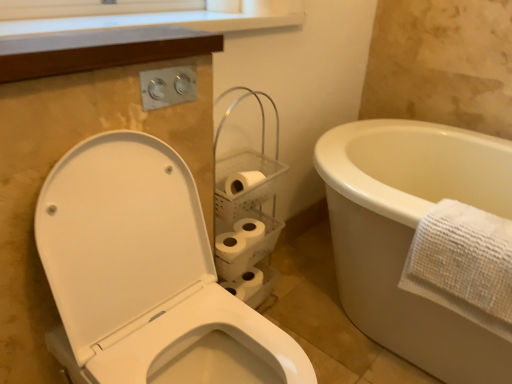
This screenshot has width=512, height=384. Identify the location of white glossy toilet at left. (145, 275).

What do you see at coordinates (463, 264) in the screenshot? The width and height of the screenshot is (512, 384). I see `white textured towel at right` at bounding box center [463, 264].

I want to click on white matte toilet paper at center, so click(239, 238).

How much distance is there between white glossy toilet at left and white textured towel at right?

They are 57.33 centimeters apart.

Does point (143, 201) lie behind point (426, 280)?

No, it is in front of (426, 280).

Between white glossy toilet at left and white textured towel at right, which one has less height?

With less height is white textured towel at right.

Are white glossy toilet at left and white textured towel at right making contact?

No.

Who is shorter, white glossy toilet at left or white matte toilet paper at center?

white matte toilet paper at center.

Looking at this image, is the depth of white glossy toilet at left greater than that of white matte toilet paper at center?

No.

From the picture: Can you confirm if white glossy toilet at left is positioned to the right of white matte toilet paper at center?

In fact, white glossy toilet at left is to the left of white matte toilet paper at center.

From the picture: Can you confirm if white matte toilet paper at center is thinner than white textured towel at right?

Yes, white matte toilet paper at center is thinner than white textured towel at right.

Is white matte toilet paper at center inside or outside of white textured towel at right?

white matte toilet paper at center is located beyond the bounds of white textured towel at right.

Considering the positions of point (238, 223) and point (489, 238), is point (238, 223) closer or farther from the camera than point (489, 238)?

Point (238, 223).

Looking at the image, does white matte toilet paper at center seem bigger or smaller compared to white textured towel at right?

Clearly, white matte toilet paper at center is smaller in size than white textured towel at right.

From a real-world perspective, is white textured towel at right on top of white matte toilet paper at center?

Correct, in the physical world, white textured towel at right is higher than white matte toilet paper at center.

Is white textured towel at right facing away from white matte toilet paper at center?

No, white matte toilet paper at center is not at the back of white textured towel at right.

Which of these two, white textured towel at right or white matte toilet paper at center, is smaller?

With smaller size is white matte toilet paper at center.

Which is in front, point (438, 286) or point (223, 249)?

Positioned in front is point (438, 286).

Is white matte toilet paper at center turned away from white glossy toilet at left?

white matte toilet paper at center does not have its back to white glossy toilet at left.

Who is more distant, white matte toilet paper at center or white glossy toilet at left?

white matte toilet paper at center.

From the image's perspective, which object appears higher, white matte toilet paper at center or white glossy toilet at left?

white matte toilet paper at center appears higher in the image.

Is white textured towel at right in front of white glossy toilet at left?

That is False.

From the image's perspective, is white textured towel at right beneath white glossy toilet at left?

Incorrect, from the image's perspective, white textured towel at right is higher than white glossy toilet at left.

Looking at this image, is white glossy toilet at left surrounded by white textured towel at right?

That's incorrect, white glossy toilet at left is not inside white textured towel at right.

What are the coordinates of `toilet that is in front of the white textured towel at right` in the screenshot? It's located at (145, 275).

Identify the location of toilet paper lying above the white glossy toilet at left (from the image's perspective). (239, 238).

Considering their positions, is white glossy toilet at left positioned closer to white textured towel at right than white matte toilet paper at center?

The object closer to white textured towel at right is white glossy toilet at left.

Considering their positions, is white glossy toilet at left positioned closer to white matte toilet paper at center than white textured towel at right?

white glossy toilet at left is positioned closer to the anchor white matte toilet paper at center.

Considering their positions, is white matte toilet paper at center positioned further to white textured towel at right than white glossy toilet at left?

Based on the image, white matte toilet paper at center appears to be further to white textured towel at right.

When comparing their distances from white matte toilet paper at center, does white textured towel at right or white glossy toilet at left seem closer?

Among the two, white glossy toilet at left is located nearer to white matte toilet paper at center.

Based on their spatial positions, is white textured towel at right or white matte toilet paper at center further from white glossy toilet at left?

white textured towel at right is further to white glossy toilet at left.

Estimate the real-world distances between objects in this image. Which object is further from white glossy toilet at left, white matte toilet paper at center or white textured towel at right?

white textured towel at right is further to white glossy toilet at left.

The width and height of the screenshot is (512, 384). I want to click on towel located between white glossy toilet at left and white matte toilet paper at center in the depth direction, so click(463, 264).